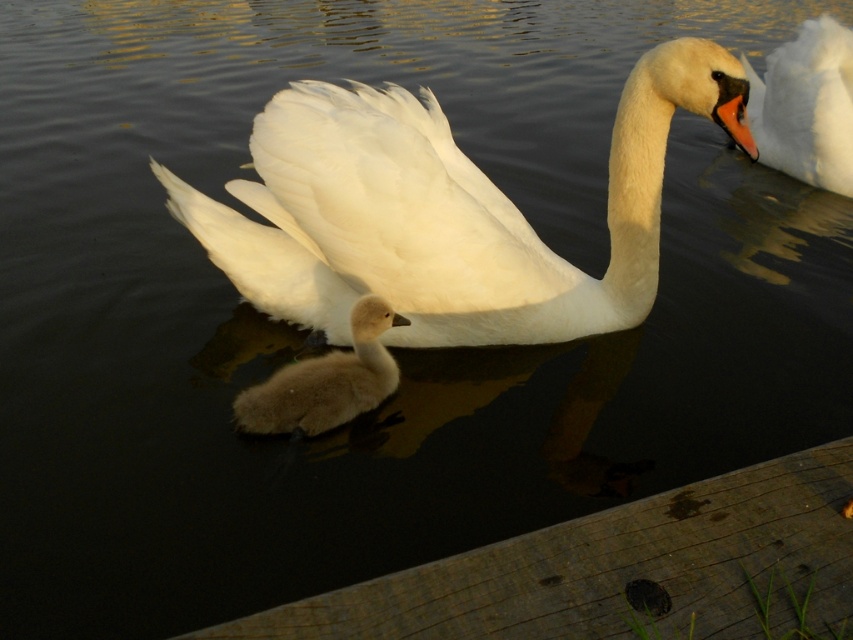
Image resolution: width=853 pixels, height=640 pixels. What do you see at coordinates (444, 211) in the screenshot?
I see `white smooth swan at center` at bounding box center [444, 211].

From the picture: Is white smooth swan at center in front of white glossy swan at upper right?

That is True.

Between point (413, 337) and point (839, 58), which one is positioned in front?

Point (413, 337)

Locate an element on the screen. white smooth swan at center is located at coordinates (444, 211).

Which is more to the right, white glossy swan at upper right or soft brown downy duckling at center?

From the viewer's perspective, white glossy swan at upper right appears more on the right side.

Find the location of `white glossy swan at upper right`. white glossy swan at upper right is located at coordinates (805, 106).

Between white smooth swan at center and soft brown downy duckling at center, which one is positioned lower?

soft brown downy duckling at center is lower down.

Is white smooth swan at center in front of soft brown downy duckling at center?

Yes, white smooth swan at center is in front of soft brown downy duckling at center.

Is point (242, 262) positioned behind point (277, 381)?

Yes, point (242, 262) is behind point (277, 381).

Locate an element on the screen. This screenshot has width=853, height=640. white smooth swan at center is located at coordinates (444, 211).